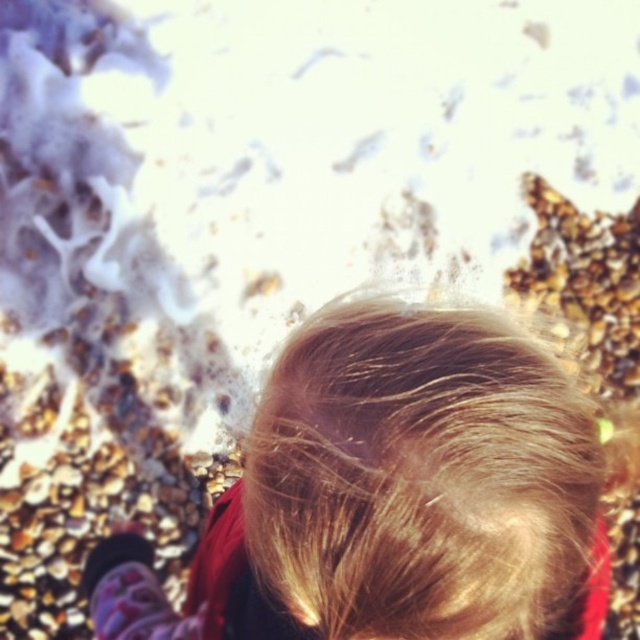
Which is above, blonde hair at center or blonde silky hair at center?

Positioned higher is blonde silky hair at center.

Identify the location of blonde hair at center. This screenshot has height=640, width=640. (392, 496).